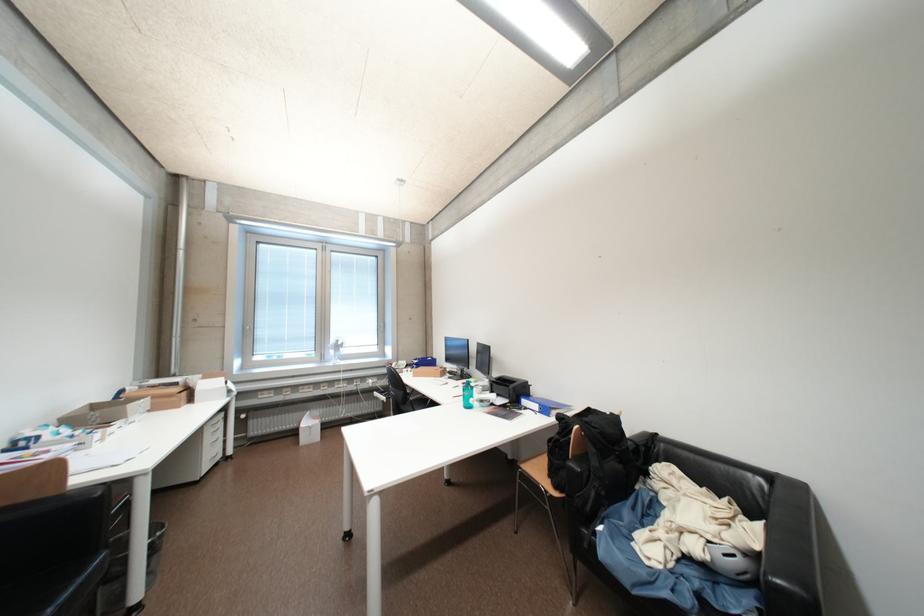
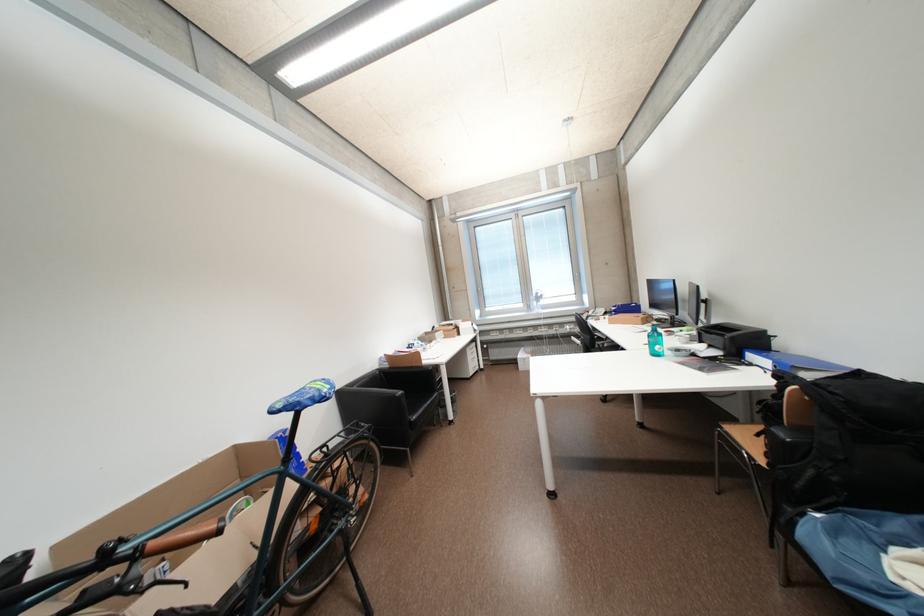
Locate, in the second image, the point that corresponds to (324,387) in the first image.

(532, 331)